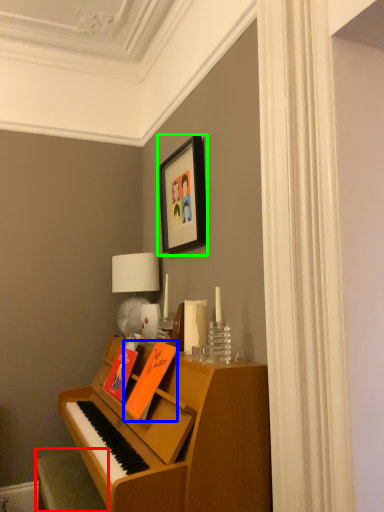
Question: Which object is positioned closest to furniture (highlighted by a red box)? Select from book (highlighted by a blue box) and picture frame (highlighted by a green box).

Choices:
 (A) book
 (B) picture frame

Answer: (A)